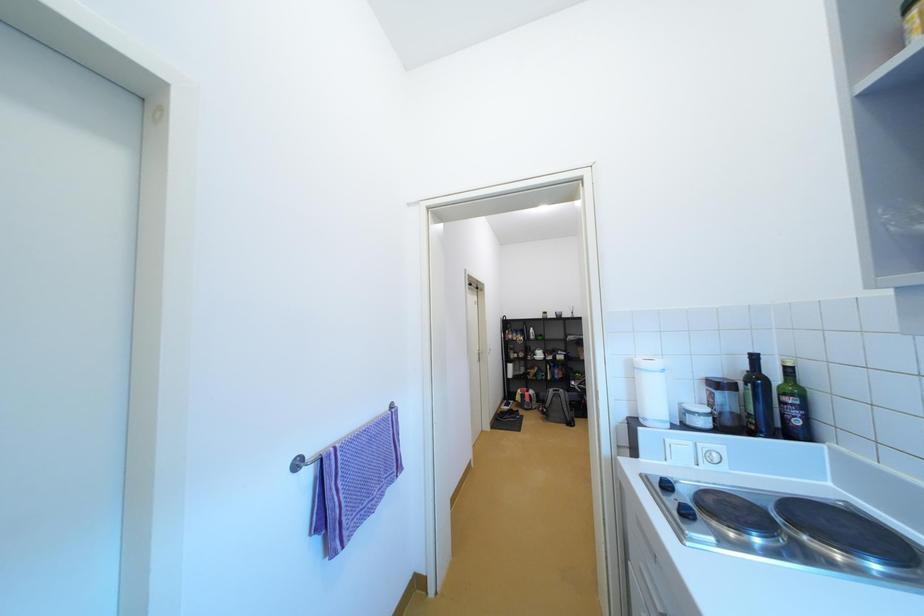
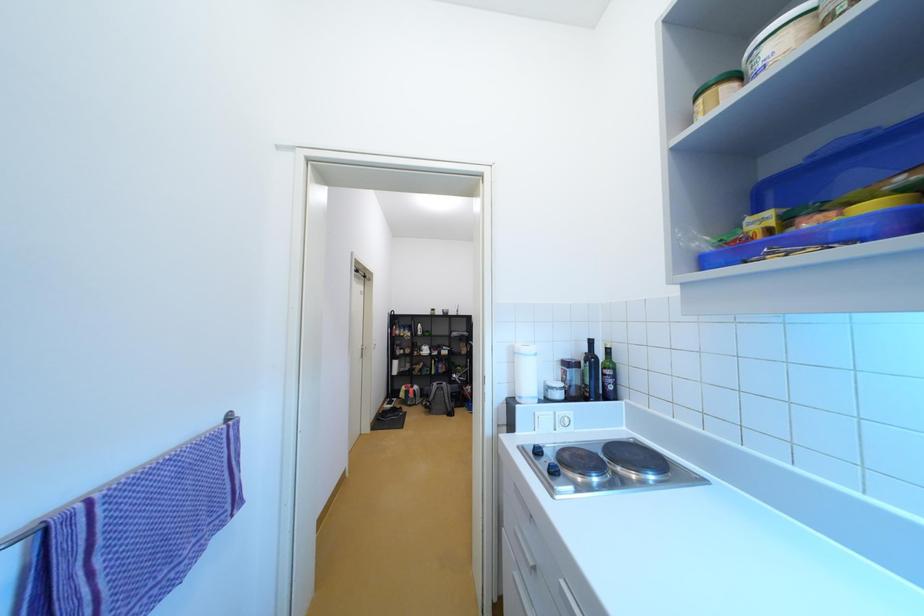
Question: The images are taken continuously from a first-person perspective. In which direction is your viewpoint rotating?

Choices:
 (A) Left
 (B) Right
 (C) Up
 (D) Down

Answer: (B)